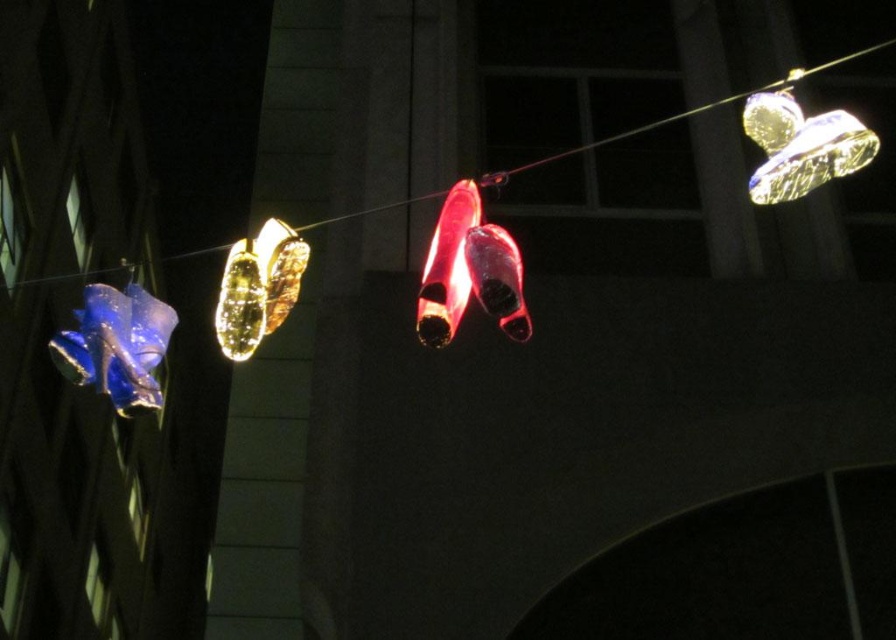
Question: Considering the real-world distances, which object is farthest from the glossy metallic shoe at upper right?

Choices:
 (A) blue translucent shoe at left
 (B) glossy plastic shoe at center

Answer: (A)

Question: Which point appears farthest from the camera in this image?

Choices:
 (A) (840, 166)
 (B) (421, 296)

Answer: (A)

Question: Considering the relative positions of glossy metallic shoe at upper right and glossy plastic shoes at center in the image provided, where is glossy metallic shoe at upper right located with respect to glossy plastic shoes at center?

Choices:
 (A) above
 (B) below

Answer: (B)

Question: Is the position of glossy metallic shoe at upper right less distant than that of glossy plastic shoes at center?

Choices:
 (A) yes
 (B) no

Answer: (A)

Question: Considering the relative positions of glossy plastic shoe at center and glossy plastic shoes at center in the image provided, where is glossy plastic shoe at center located with respect to glossy plastic shoes at center?

Choices:
 (A) above
 (B) below

Answer: (B)

Question: Which object is farther from the camera taking this photo?

Choices:
 (A) glossy metallic shoe at upper right
 (B) glossy plastic shoes at center

Answer: (B)